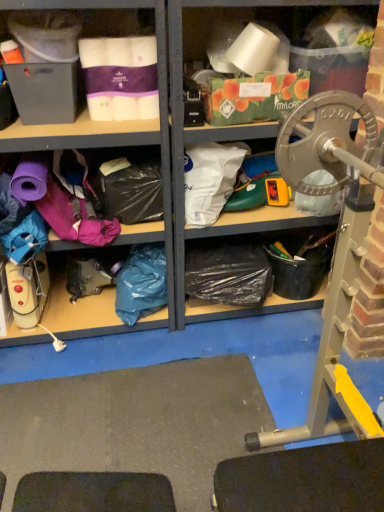
How much space does white plastic bag at center, arranged as the 2th clothing when viewed from the left, occupy vertically?

13.17 inches.

What do you see at coordinates (209, 180) in the screenshot? The image size is (384, 512). I see `white plastic bag at center, which is the 2th clothing in bottom-to-top order` at bounding box center [209, 180].

In order to face white plastic bag at center, the first clothing viewed from the top, should I rotate leftwards or rightwards?

Turn right approximately 2.192 degrees to face it.

Identify the location of white plastic bag at center, arranged as the 2th clothing when viewed from the left. Image resolution: width=384 pixels, height=512 pixels. (209, 180).

Measure the distance between point (142,315) and camera.

Point (142,315) and camera are 2.03 meters apart from each other.

Describe the element at coordinates (141, 283) in the screenshot. I see `blue plastic bag at lower left, placed as the 1th clothing when sorted from left to right` at that location.

The height and width of the screenshot is (512, 384). What are the coordinates of `blue plastic bag at lower left, placed as the 1th clothing when sorted from left to right` in the screenshot? It's located at (141, 283).

The height and width of the screenshot is (512, 384). Find the location of `white plastic bag at center, positioned as the 1th clothing in right-to-left order`. white plastic bag at center, positioned as the 1th clothing in right-to-left order is located at coordinates (209, 180).

Can you confirm if white plastic bag at center, which is the 2th clothing in bottom-to-top order, is positioned to the right of blue plastic bag at lower left, placed as the 1th clothing when sorted from left to right?

Correct, you'll find white plastic bag at center, which is the 2th clothing in bottom-to-top order, to the right of blue plastic bag at lower left, placed as the 1th clothing when sorted from left to right.

Looking at this image, is white plastic bag at center, arranged as the 2th clothing when viewed from the left, in front of or behind blue plastic bag at lower left, placed as the 1th clothing when sorted from left to right, in the image?

white plastic bag at center, arranged as the 2th clothing when viewed from the left, is positioned closer to the viewer than blue plastic bag at lower left, placed as the 1th clothing when sorted from left to right.

Is point (216, 182) less distant than point (158, 293)?

Yes, it is.

From the image's perspective, who appears lower, white plastic bag at center, positioned as the 1th clothing in right-to-left order, or blue plastic bag at lower left, the 2th clothing viewed from the right?

blue plastic bag at lower left, the 2th clothing viewed from the right, is shown below in the image.

From a real-world perspective, is white plastic bag at center, the first clothing viewed from the top, above or below blue plastic bag at lower left, positioned as the 1th clothing in bottom-to-top order?

Clearly, from a real-world perspective, white plastic bag at center, the first clothing viewed from the top, is above blue plastic bag at lower left, positioned as the 1th clothing in bottom-to-top order.

Between white plastic bag at center, the first clothing viewed from the top, and blue plastic bag at lower left, placed as the 1th clothing when sorted from left to right, which one has larger width?

Wider between the two is white plastic bag at center, the first clothing viewed from the top.

Between white plastic bag at center, arranged as the 2th clothing when viewed from the left, and blue plastic bag at lower left, the 2th clothing viewed from the right, which one has more height?

With more height is blue plastic bag at lower left, the 2th clothing viewed from the right.

Between white plastic bag at center, positioned as the 1th clothing in right-to-left order, and blue plastic bag at lower left, positioned as the 1th clothing in bottom-to-top order, which one has larger size?

With larger size is blue plastic bag at lower left, positioned as the 1th clothing in bottom-to-top order.

Based on the photo, is white plastic bag at center, the first clothing viewed from the top, not within blue plastic bag at lower left, which appears as the second clothing when viewed from the top?

Yes, white plastic bag at center, the first clothing viewed from the top, is outside of blue plastic bag at lower left, which appears as the second clothing when viewed from the top.

Is white plastic bag at center, which is the 2th clothing in bottom-to-top order, next to blue plastic bag at lower left, placed as the 1th clothing when sorted from left to right?

No, white plastic bag at center, which is the 2th clothing in bottom-to-top order, is not with blue plastic bag at lower left, placed as the 1th clothing when sorted from left to right.

Looking at this image, is white plastic bag at center, which is the 2th clothing in bottom-to-top order, turned away from blue plastic bag at lower left, positioned as the 1th clothing in bottom-to-top order?

white plastic bag at center, which is the 2th clothing in bottom-to-top order, does not have its back to blue plastic bag at lower left, positioned as the 1th clothing in bottom-to-top order.

How different are the orientations of white plastic bag at center, positioned as the 1th clothing in right-to-left order, and blue plastic bag at lower left, the 2th clothing viewed from the right, in degrees?

white plastic bag at center, positioned as the 1th clothing in right-to-left order, and blue plastic bag at lower left, the 2th clothing viewed from the right, are facing 6.79 degrees away from each other.

Image resolution: width=384 pixels, height=512 pixels. What are the coordinates of `clothing on the right of blue plastic bag at lower left, the 2th clothing viewed from the right` in the screenshot? It's located at (209, 180).

Between blue plastic bag at lower left, which appears as the second clothing when viewed from the top, and white plastic bag at center, which is the 2th clothing in bottom-to-top order, which one appears on the left side from the viewer's perspective?

Positioned to the left is blue plastic bag at lower left, which appears as the second clothing when viewed from the top.

Considering the positions of objects blue plastic bag at lower left, placed as the 1th clothing when sorted from left to right, and white plastic bag at center, arranged as the 2th clothing when viewed from the left, in the image provided, who is behind, blue plastic bag at lower left, placed as the 1th clothing when sorted from left to right, or white plastic bag at center, arranged as the 2th clothing when viewed from the left,?

blue plastic bag at lower left, placed as the 1th clothing when sorted from left to right, is behind.

Is point (117, 284) positioned before point (205, 223)?

No, it is not.

From the image's perspective, between blue plastic bag at lower left, placed as the 1th clothing when sorted from left to right, and white plastic bag at center, positioned as the 1th clothing in right-to-left order, which one is located above?

From the image's view, white plastic bag at center, positioned as the 1th clothing in right-to-left order, is above.

From a real-world perspective, who is located higher, blue plastic bag at lower left, which appears as the second clothing when viewed from the top, or white plastic bag at center, positioned as the 1th clothing in right-to-left order?

white plastic bag at center, positioned as the 1th clothing in right-to-left order, is physically above.

Considering the sizes of objects blue plastic bag at lower left, the 2th clothing viewed from the right, and white plastic bag at center, the first clothing viewed from the top, in the image provided, who is thinner, blue plastic bag at lower left, the 2th clothing viewed from the right, or white plastic bag at center, the first clothing viewed from the top,?

blue plastic bag at lower left, the 2th clothing viewed from the right.

From the picture: Can you confirm if blue plastic bag at lower left, the 2th clothing viewed from the right, is taller than white plastic bag at center, which is the 2th clothing in bottom-to-top order?

Yes, blue plastic bag at lower left, the 2th clothing viewed from the right, is taller than white plastic bag at center, which is the 2th clothing in bottom-to-top order.

Does blue plastic bag at lower left, positioned as the 1th clothing in bottom-to-top order, have a larger size compared to white plastic bag at center, positioned as the 1th clothing in right-to-left order?

Indeed, blue plastic bag at lower left, positioned as the 1th clothing in bottom-to-top order, has a larger size compared to white plastic bag at center, positioned as the 1th clothing in right-to-left order.

Would you say white plastic bag at center, which is the 2th clothing in bottom-to-top order, is part of blue plastic bag at lower left, placed as the 1th clothing when sorted from left to right,'s contents?

No, blue plastic bag at lower left, placed as the 1th clothing when sorted from left to right, does not contain white plastic bag at center, which is the 2th clothing in bottom-to-top order.

Is the surface of blue plastic bag at lower left, the 2th clothing viewed from the right, in direct contact with white plastic bag at center, positioned as the 1th clothing in right-to-left order?

No, blue plastic bag at lower left, the 2th clothing viewed from the right, is not in contact with white plastic bag at center, positioned as the 1th clothing in right-to-left order.

Is blue plastic bag at lower left, positioned as the 1th clothing in bottom-to-top order, positioned with its back to white plastic bag at center, which is the 2th clothing in bottom-to-top order?

No, blue plastic bag at lower left, positioned as the 1th clothing in bottom-to-top order, is not facing away from white plastic bag at center, which is the 2th clothing in bottom-to-top order.

Locate an element on the screen. The width and height of the screenshot is (384, 512). clothing above the blue plastic bag at lower left, placed as the 1th clothing when sorted from left to right (from a real-world perspective) is located at coordinates click(209, 180).

Locate an element on the screen. This screenshot has height=512, width=384. clothing behind the white plastic bag at center, the first clothing viewed from the top is located at coordinates point(141,283).

Find the location of a particular element. Image resolution: width=384 pixels, height=512 pixels. clothing above the blue plastic bag at lower left, placed as the 1th clothing when sorted from left to right (from the image's perspective) is located at coordinates (209, 180).